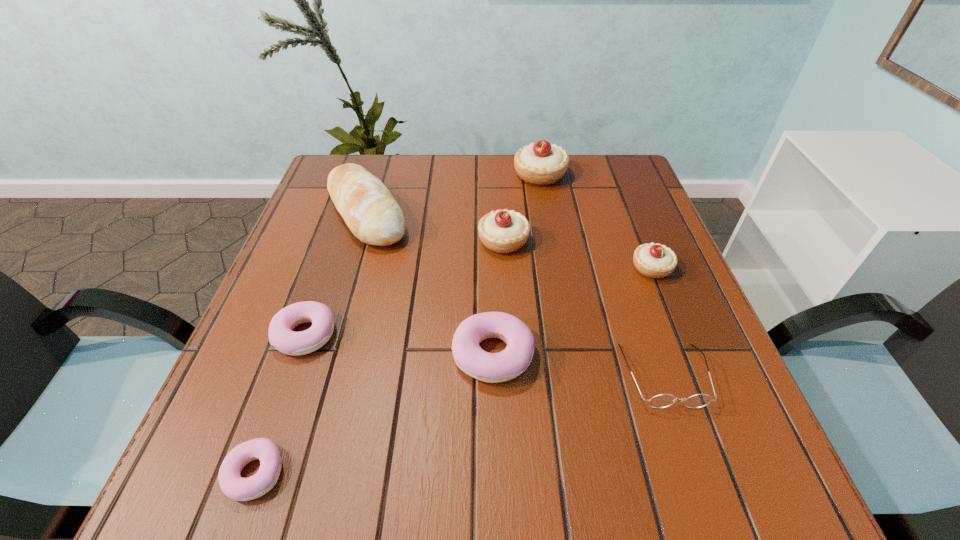
Find the location of `vacant space located 0.200m on the right of the nearest pink pastry`. vacant space located 0.200m on the right of the nearest pink pastry is located at coordinates (417, 473).

You are a GUI agent. You are given a task and a screenshot of the screen. Output one action in this format:
    pyautogui.click(x=<x>, y=<y>)
    Task: Click on the pastry positioned at the far edge
    The width and height of the screenshot is (960, 540).
    Given the screenshot: What is the action you would take?
    pyautogui.click(x=540, y=163)

Identify the location of bread that is at the far edge. This screenshot has width=960, height=540. (368, 208).

This screenshot has width=960, height=540. Identify the location of object that is at the near edge. (235, 487).

Find the location of a particular element. Image resolution: width=960 pixels, height=540 pixels. bread present at the left edge is located at coordinates (368, 208).

Find the location of `pastry that is at the right edge`. pastry that is at the right edge is located at coordinates (652, 260).

Where is `spectacles present at the right edge`? spectacles present at the right edge is located at coordinates (663, 400).

At what (x,y) coordinates should I click in order to perform the action: click on object situated at the far left corner. Please return your answer as a coordinate pair (x, y). Image resolution: width=960 pixels, height=540 pixels. Looking at the image, I should click on (368, 208).

Where is `object positioned at the near left corner`? This screenshot has height=540, width=960. object positioned at the near left corner is located at coordinates (235, 487).

At what (x,y) coordinates should I click in order to perform the action: click on free space at the far edge. Please return your answer as a coordinate pair (x, y). The height and width of the screenshot is (540, 960). Looking at the image, I should click on (569, 192).